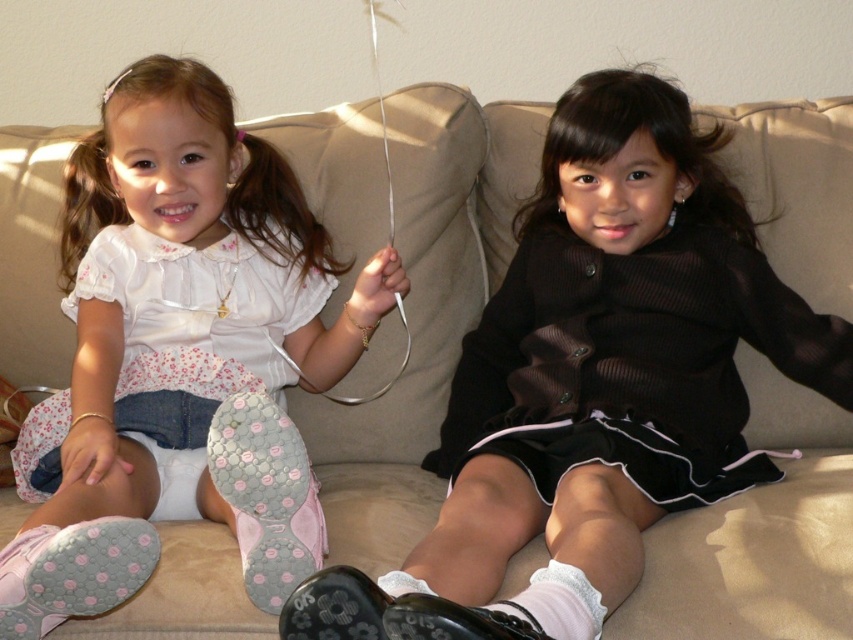
Is point (675, 364) behind point (241, 529)?

Yes, it is behind point (241, 529).

Which is more to the right, matte black dress at center or matte pink sneakers at lower left?

matte black dress at center is more to the right.

Who is more distant from viewer, (361, 632) or (285, 256)?

Positioned behind is point (285, 256).

Image resolution: width=853 pixels, height=640 pixels. I want to click on matte black dress at center, so tap(593, 381).